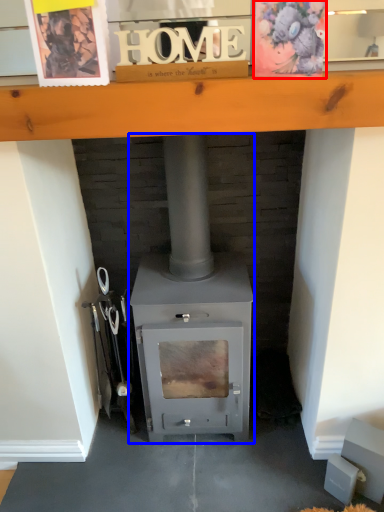
Question: Which point is further to the camera, postcard (highlighted by a red box) or wood burning stove (highlighted by a blue box)?

Choices:
 (A) postcard
 (B) wood burning stove

Answer: (B)